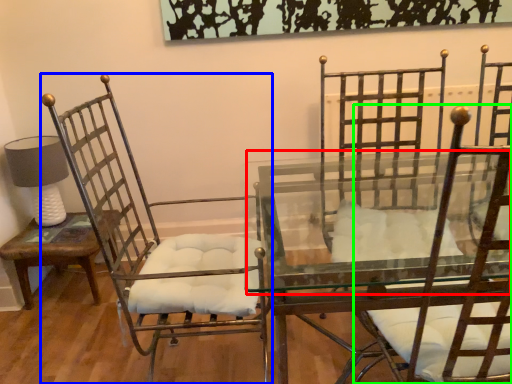
Question: Considering the real-world distances, which object is farthest from round table (highlighted by a red box)? chair (highlighted by a blue box) or chair (highlighted by a green box)?

Choices:
 (A) chair
 (B) chair

Answer: (B)